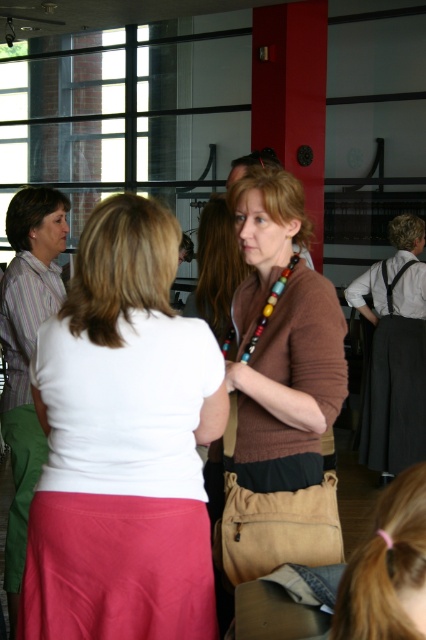
How distant is white matte shirt at center from brown matte sweater at center?

white matte shirt at center and brown matte sweater at center are 12.52 inches apart from each other.

Is point (111, 566) farther from viewer compared to point (256, 202)?

No, (111, 566) is closer to viewer.

This screenshot has height=640, width=426. I want to click on white matte shirt at center, so click(123, 444).

Where is `white matte shirt at center`? This screenshot has width=426, height=640. white matte shirt at center is located at coordinates (123, 444).